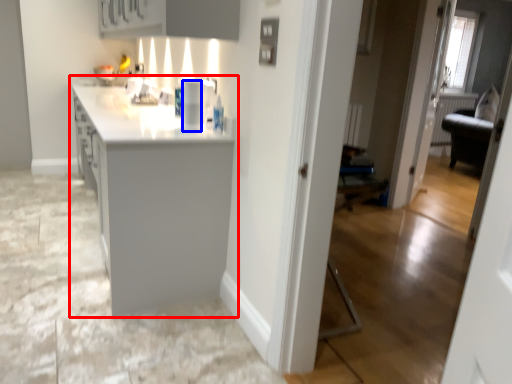
Question: Which point is further to the camera, countertop (highlighted by a red box) or appliance (highlighted by a blue box)?

Choices:
 (A) countertop
 (B) appliance

Answer: (B)